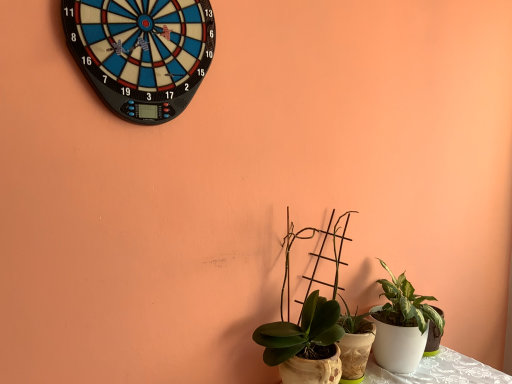
Question: Is white glossy pot at lower right, which appears as the 1th houseplant when viewed from the right, not close to green matte plant at center, the 1th houseplant from the left?

Choices:
 (A) no
 (B) yes

Answer: (A)

Question: From a real-world perspective, is white glossy pot at lower right, which appears as the 1th houseplant when viewed from the right, located higher than green matte plant at center, which is the second houseplant in right-to-left order?

Choices:
 (A) yes
 (B) no

Answer: (B)

Question: Is white glossy pot at lower right, which appears as the 1th houseplant when viewed from the right, oriented away from green matte plant at center, which is the second houseplant in right-to-left order?

Choices:
 (A) no
 (B) yes

Answer: (A)

Question: Does white glossy pot at lower right, the 2th houseplant in the left-to-right sequence, appear on the right side of green matte plant at center, which is the second houseplant in right-to-left order?

Choices:
 (A) yes
 (B) no

Answer: (A)

Question: Is the position of white glossy pot at lower right, the 2th houseplant in the left-to-right sequence, more distant than that of green matte plant at center, which is the second houseplant in right-to-left order?

Choices:
 (A) yes
 (B) no

Answer: (A)

Question: From the image's perspective, is white glossy pot at lower right, the 2th houseplant in the left-to-right sequence, located beneath green matte plant at center, the 1th houseplant from the left?

Choices:
 (A) yes
 (B) no

Answer: (A)

Question: Is blue plastic dartboard at upper left not inside green matte plant at center, which is the second houseplant in right-to-left order?

Choices:
 (A) no
 (B) yes

Answer: (B)

Question: Considering the relative sizes of blue plastic dartboard at upper left and green matte plant at center, which is the second houseplant in right-to-left order, in the image provided, is blue plastic dartboard at upper left shorter than green matte plant at center, which is the second houseplant in right-to-left order,?

Choices:
 (A) yes
 (B) no

Answer: (A)

Question: Does blue plastic dartboard at upper left have a greater height compared to green matte plant at center, which is the second houseplant in right-to-left order?

Choices:
 (A) no
 (B) yes

Answer: (A)

Question: Is blue plastic dartboard at upper left oriented towards green matte plant at center, which is the second houseplant in right-to-left order?

Choices:
 (A) no
 (B) yes

Answer: (A)

Question: Considering the relative sizes of blue plastic dartboard at upper left and green matte plant at center, which is the second houseplant in right-to-left order, in the image provided, is blue plastic dartboard at upper left bigger than green matte plant at center, which is the second houseplant in right-to-left order,?

Choices:
 (A) no
 (B) yes

Answer: (A)

Question: Is blue plastic dartboard at upper left at the left side of green matte plant at center, which is the second houseplant in right-to-left order?

Choices:
 (A) yes
 (B) no

Answer: (A)

Question: Does green matte plant at center, which is the second houseplant in right-to-left order, come behind white glossy pot at lower right, the 2th houseplant in the left-to-right sequence?

Choices:
 (A) yes
 (B) no

Answer: (B)